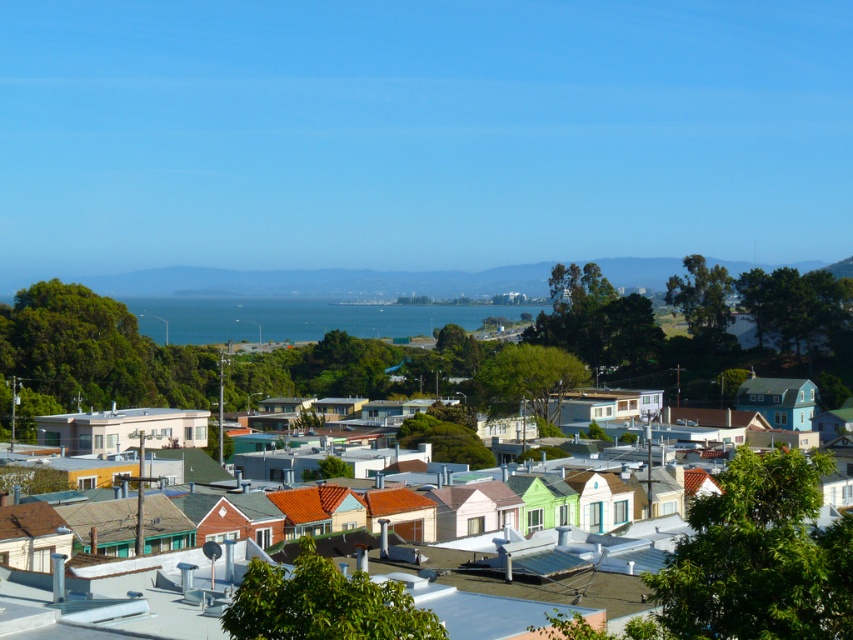
You are standing at the point marked as point (91, 356) in the residential area. What are you standing on?

You are standing on multicolored rooftops at center because the point (91, 356) is on multicolored rooftops at center.

You are standing at the edge of the residential area looking towards the distant hills. You notice the multicolored rooftops at center and the blue water at center. Based on their positions, which one is closer to you?

The multicolored rooftops at center are closer to you since they are positioned below the blue water at center, indicating they are in front in the visual plane.

In the scene shown: You are a drone operator who needs to capture a wide aerial shot of the residential area. The multicolored rooftops at center and the blue water at center are both in your camera frame. Which of the two objects takes up less horizontal space in the image?

The multicolored rooftops at center has a lesser width compared to blue water at center, so the multicolored rooftops at center takes up less horizontal space in the image.